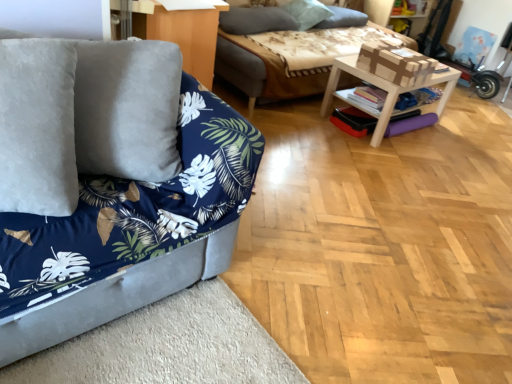
Question: Does soft gray pillow at upper center, acting as the first pillow starting from the right, have a lesser width compared to gray soft pillow at upper center, which is the second pillow from left to right?

Choices:
 (A) yes
 (B) no

Answer: (A)

Question: From the image's perspective, would you say soft gray pillow at upper center, acting as the first pillow starting from the right, is positioned over gray soft pillow at upper center, which is the second pillow from left to right?

Choices:
 (A) yes
 (B) no

Answer: (A)

Question: From the image's perspective, would you say soft gray pillow at upper center, acting as the first pillow starting from the right, is shown under gray soft pillow at upper center, which is the second pillow from left to right?

Choices:
 (A) no
 (B) yes

Answer: (A)

Question: Is soft gray pillow at upper center, acting as the first pillow starting from the right, directly adjacent to gray soft pillow at upper center, which is the second pillow from left to right?

Choices:
 (A) no
 (B) yes

Answer: (A)

Question: Is gray soft pillow at upper center, which is the second pillow from left to right, at the back of soft gray pillow at upper center, acting as the first pillow starting from the right?

Choices:
 (A) no
 (B) yes

Answer: (A)

Question: From the image's perspective, is soft gray pillow at upper center, which is the third pillow from left to right, located above or below velvet blue couch at left, marked as the first studio couch in a front-to-back arrangement?

Choices:
 (A) below
 (B) above

Answer: (B)

Question: Is point (340, 16) positioned closer to the camera than point (220, 226)?

Choices:
 (A) farther
 (B) closer

Answer: (A)

Question: From their relative heights in the image, would you say soft gray pillow at upper center, which is the third pillow from left to right, is taller or shorter than velvet blue couch at left, which appears as the second studio couch when viewed from the back?

Choices:
 (A) tall
 (B) short

Answer: (B)

Question: Do you think soft gray pillow at upper center, acting as the first pillow starting from the right, is within velvet blue couch at left, which ranks as the 1th studio couch in bottom-to-top order, or outside of it?

Choices:
 (A) outside
 (B) inside

Answer: (A)

Question: Is soft gray pillow at upper center, which is the third pillow from left to right, taller or shorter than gray soft pillow at upper center, the third pillow when ordered from right to left?

Choices:
 (A) tall
 (B) short

Answer: (A)

Question: From the image's perspective, is soft gray pillow at upper center, which is the third pillow from left to right, above or below gray soft pillow at upper center, which is counted as the 1th pillow, starting from the left?

Choices:
 (A) above
 (B) below

Answer: (A)

Question: Is soft gray pillow at upper center, which is the third pillow from left to right, spatially inside gray soft pillow at upper center, which is counted as the 1th pillow, starting from the left, or outside of it?

Choices:
 (A) outside
 (B) inside

Answer: (A)

Question: Considering the positions of soft gray pillow at upper center, acting as the first pillow starting from the right, and gray soft pillow at upper center, the third pillow when ordered from right to left, in the image, is soft gray pillow at upper center, acting as the first pillow starting from the right, wider or thinner than gray soft pillow at upper center, the third pillow when ordered from right to left,?

Choices:
 (A) wide
 (B) thin

Answer: (A)

Question: In terms of height, does wooden table at center look taller or shorter compared to gray soft pillow at upper center, which is the second pillow from left to right?

Choices:
 (A) short
 (B) tall

Answer: (B)

Question: Considering their positions, is wooden table at center located in front of or behind gray soft pillow at upper center, which is the 2th pillow from right to left?

Choices:
 (A) behind
 (B) front

Answer: (B)